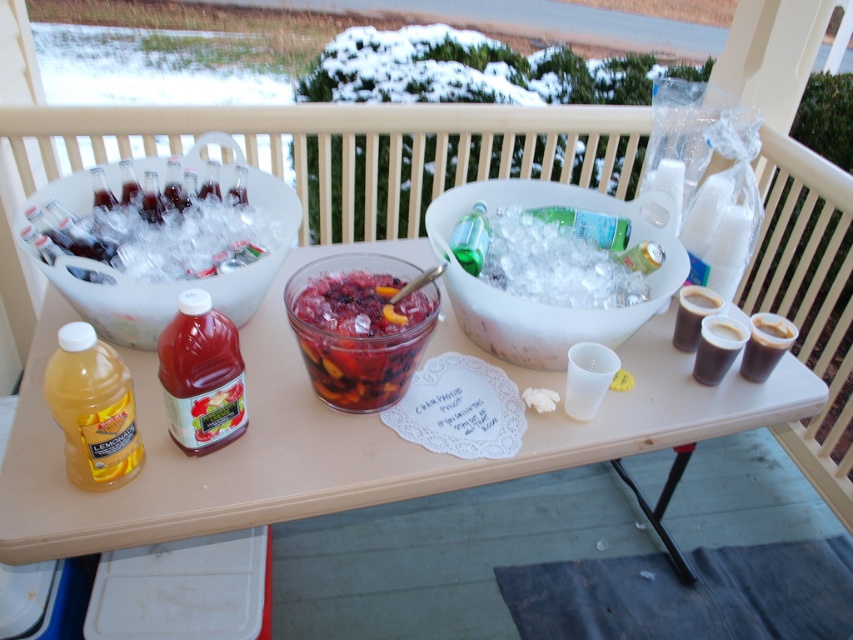
Which is below, translucent glass punch bowl at center or dark brown glass at right?

dark brown glass at right is lower down.

Can you confirm if translucent glass punch bowl at center is positioned above dark brown glass at right?

Indeed, translucent glass punch bowl at center is positioned over dark brown glass at right.

Is point (310, 328) behind point (714, 305)?

No, it is not.

The width and height of the screenshot is (853, 640). I want to click on translucent glass punch bowl at center, so click(x=360, y=326).

Can you confirm if red matte plastic bottle at lower left is positioned to the right of black matte cup at right?

Incorrect, red matte plastic bottle at lower left is not on the right side of black matte cup at right.

Can you confirm if red matte plastic bottle at lower left is smaller than black matte cup at right?

Incorrect, red matte plastic bottle at lower left is not smaller in size than black matte cup at right.

Does point (198, 352) come behind point (695, 356)?

No, (198, 352) is closer to viewer.

Locate an element on the screen. red matte plastic bottle at lower left is located at coordinates (201, 376).

Does yellow translucent plastic bottle at lower left appear on the left side of dark brown liquid at upper right?

Indeed, yellow translucent plastic bottle at lower left is positioned on the left side of dark brown liquid at upper right.

Who is more forward, (114, 364) or (766, 339)?

Point (114, 364)

This screenshot has height=640, width=853. What do you see at coordinates (93, 410) in the screenshot? I see `yellow translucent plastic bottle at lower left` at bounding box center [93, 410].

Image resolution: width=853 pixels, height=640 pixels. In order to click on yellow translucent plastic bottle at lower left in this screenshot , I will do `click(93, 410)`.